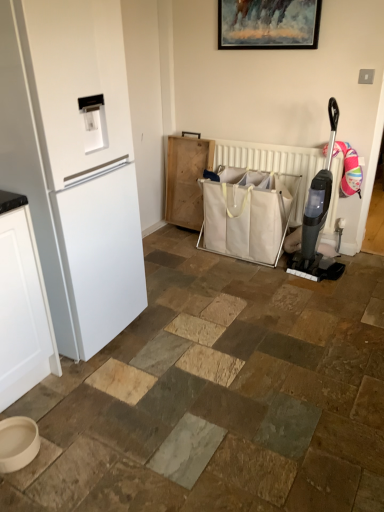
What is the approximate height of black plastic vacuum cleaner at right?

The height of black plastic vacuum cleaner at right is 3.67 feet.

In order to face wooden picture frame at upper center, should I rotate leftwards or rightwards?

It's best to rotate right around 9.542 degrees.

What do you see at coordinates (268, 24) in the screenshot? I see `wooden picture frame at upper center` at bounding box center [268, 24].

You are a GUI agent. You are given a task and a screenshot of the screen. Output one action in this format:
    pyautogui.click(x=<x>, y=<y>)
    Task: Click on the white fabric bag at center
    This screenshot has height=512, width=384.
    Given the screenshot: What is the action you would take?
    pyautogui.click(x=273, y=164)

Where is `white canvas shopping bag at center`? The height and width of the screenshot is (512, 384). white canvas shopping bag at center is located at coordinates (247, 214).

Locate an element on the screen. black plastic vacuum cleaner at right is located at coordinates (318, 217).

Where is `refrigerator positioned vertically above the black plastic vacuum cleaner at right (from a real-world perspective)`? The height and width of the screenshot is (512, 384). refrigerator positioned vertically above the black plastic vacuum cleaner at right (from a real-world perspective) is located at coordinates (74, 162).

From the image's perspective, which is below, black plastic vacuum cleaner at right or white matte refrigerator at left?

white matte refrigerator at left is shown below in the image.

Measure the distance between black plastic vacuum cleaner at right and white matte refrigerator at left.

black plastic vacuum cleaner at right is 1.43 meters from white matte refrigerator at left.

Is the depth of black plastic vacuum cleaner at right greater than that of white matte refrigerator at left?

Yes, it is.

From a real-world perspective, is black plastic vacuum cleaner at right above or below white canvas shopping bag at center?

From a real-world perspective, black plastic vacuum cleaner at right is physically above white canvas shopping bag at center.

Is black plastic vacuum cleaner at right completely or partially outside of white canvas shopping bag at center?

Yes, black plastic vacuum cleaner at right is not within white canvas shopping bag at center.

Considering the positions of objects black plastic vacuum cleaner at right and white canvas shopping bag at center in the image provided, who is in front, black plastic vacuum cleaner at right or white canvas shopping bag at center?

Positioned in front is black plastic vacuum cleaner at right.

From the image's perspective, is black plastic vacuum cleaner at right above or below white canvas shopping bag at center?

black plastic vacuum cleaner at right is above white canvas shopping bag at center.

The height and width of the screenshot is (512, 384). Find the location of `refrigerator above the white canvas shopping bag at center (from a real-world perspective)`. refrigerator above the white canvas shopping bag at center (from a real-world perspective) is located at coordinates (74, 162).

Can you confirm if white matte refrigerator at left is positioned to the right of white canvas shopping bag at center?

In fact, white matte refrigerator at left is to the left of white canvas shopping bag at center.

From their relative heights in the image, would you say white matte refrigerator at left is taller or shorter than white canvas shopping bag at center?

white matte refrigerator at left is taller than white canvas shopping bag at center.

From a real-world perspective, relative to black plastic vacuum cleaner at right, is white matte refrigerator at left vertically above or below?

Clearly, from a real-world perspective, white matte refrigerator at left is above black plastic vacuum cleaner at right.

In terms of size, does white matte refrigerator at left appear bigger or smaller than black plastic vacuum cleaner at right?

white matte refrigerator at left is bigger than black plastic vacuum cleaner at right.

Locate an element on the screen. Image resolution: width=384 pixels, height=512 pixels. appliance on the right of white matte refrigerator at left is located at coordinates (318, 217).

From a real-world perspective, is white matte refrigerator at left physically below white fabric bag at center?

No.

Can you confirm if white matte refrigerator at left is smaller than white fabric bag at center?

Actually, white matte refrigerator at left might be larger than white fabric bag at center.

Is the position of white matte refrigerator at left more distant than that of white fabric bag at center?

No.

Is white matte refrigerator at left looking in the opposite direction of white fabric bag at center?

No, white matte refrigerator at left is not facing the opposite direction of white fabric bag at center.

In the scene shown: From a real-world perspective, relative to white fabric bag at center, is white canvas shopping bag at center vertically above or below?

white canvas shopping bag at center is situated lower than white fabric bag at center in the real world.

From the image's perspective, is white canvas shopping bag at center under white fabric bag at center?

Yes, from the image's perspective, white canvas shopping bag at center is beneath white fabric bag at center.

Who is smaller, white canvas shopping bag at center or white fabric bag at center?

With smaller size is white fabric bag at center.

The image size is (384, 512). Find the location of `shopping bag lying behind the black plastic vacuum cleaner at right`. shopping bag lying behind the black plastic vacuum cleaner at right is located at coordinates (247, 214).

What's the angular difference between white canvas shopping bag at center and black plastic vacuum cleaner at right's facing directions?

They differ by 2.19 degrees in their facing directions.

How much distance is there between white canvas shopping bag at center and black plastic vacuum cleaner at right?

They are 34.91 centimeters apart.

Is white canvas shopping bag at center situated inside black plastic vacuum cleaner at right or outside?

white canvas shopping bag at center exists outside the volume of black plastic vacuum cleaner at right.

Find the location of a particular element. The image size is (384, 512). refrigerator lying below the black plastic vacuum cleaner at right (from the image's perspective) is located at coordinates (74, 162).

You are a GUI agent. You are given a task and a screenshot of the screen. Output one action in this format:
    pyautogui.click(x=<x>, y=<y>)
    Task: Click on the appliance on the right of white canvas shopping bag at center
    This screenshot has width=384, height=512.
    Given the screenshot: What is the action you would take?
    pyautogui.click(x=318, y=217)

From the picture: From the image, which object appears to be nearer to wooden picture frame at upper center, white canvas shopping bag at center or white fabric bag at center?

Among the two, white fabric bag at center is located nearer to wooden picture frame at upper center.

Estimate the real-world distances between objects in this image. Which object is closer to white canvas shopping bag at center, white matte refrigerator at left or wooden picture frame at upper center?

wooden picture frame at upper center is positioned closer to the anchor white canvas shopping bag at center.

Looking at the image, which one is located closer to black plastic vacuum cleaner at right, white matte refrigerator at left or white canvas shopping bag at center?

white canvas shopping bag at center.

Based on their spatial positions, is wooden picture frame at upper center or white canvas shopping bag at center closer to white fabric bag at center?

The object closer to white fabric bag at center is white canvas shopping bag at center.

Based on their spatial positions, is white canvas shopping bag at center or black plastic vacuum cleaner at right closer to white matte refrigerator at left?

white canvas shopping bag at center.

When comparing their distances from white canvas shopping bag at center, does black plastic vacuum cleaner at right or white fabric bag at center seem closer?

Based on the image, white fabric bag at center appears to be nearer to white canvas shopping bag at center.

From the image, which object appears to be farther from wooden picture frame at upper center, white matte refrigerator at left or black plastic vacuum cleaner at right?

Among the two, white matte refrigerator at left is located further to wooden picture frame at upper center.

Looking at the image, which one is located further to white fabric bag at center, white canvas shopping bag at center or white matte refrigerator at left?

Among the two, white matte refrigerator at left is located further to white fabric bag at center.

I want to click on picture frame between white matte refrigerator at left and white canvas shopping bag at center from front to back, so click(268, 24).

This screenshot has height=512, width=384. Identify the location of picture frame situated between white matte refrigerator at left and black plastic vacuum cleaner at right from left to right. (268, 24).

At what (x,y) coordinates should I click in order to perform the action: click on shopping bag between black plastic vacuum cleaner at right and white fabric bag at center in the front-back direction. Please return your answer as a coordinate pair (x, y). The image size is (384, 512). Looking at the image, I should click on (247, 214).

I want to click on shopping bag between white matte refrigerator at left and black plastic vacuum cleaner at right from left to right, so click(x=247, y=214).